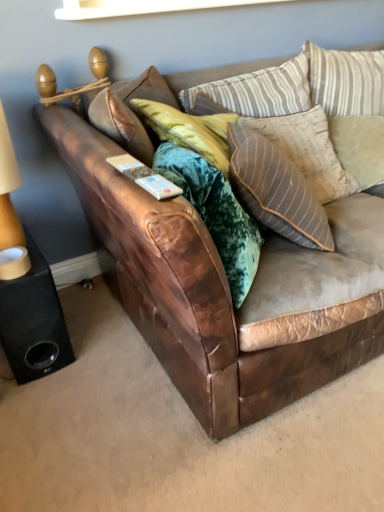
What is the approximate height of striped fabric pillow at upper center, placed as the 1th pillow when sorted from left to right?

The height of striped fabric pillow at upper center, placed as the 1th pillow when sorted from left to right, is 24.21 centimeters.

Find the location of a particular element. This screenshot has height=512, width=384. striped fabric pillow at upper center, the third pillow when ordered from right to left is located at coordinates (259, 91).

I want to click on striped fabric pillow at upper center, the third pillow when ordered from right to left, so click(x=259, y=91).

Is brown leather couch at center shorter than beige fabric lampshade at left?

In fact, brown leather couch at center may be taller than beige fabric lampshade at left.

Considering the positions of objects brown leather couch at center and beige fabric lampshade at left in the image provided, who is behind, brown leather couch at center or beige fabric lampshade at left?

Positioned behind is beige fabric lampshade at left.

Who is bigger, brown leather couch at center or beige fabric lampshade at left?

With larger size is brown leather couch at center.

Would you say brown leather couch at center is outside beige fabric lampshade at left?

brown leather couch at center lies outside beige fabric lampshade at left's area.

Based on the photo, could you tell me if brown leather couch at center is facing black matte speaker at lower left?

No, brown leather couch at center is not facing towards black matte speaker at lower left.

Measure the distance from brown leather couch at center to black matte speaker at lower left.

brown leather couch at center and black matte speaker at lower left are 19.80 inches apart from each other.

Is brown leather couch at center taller than black matte speaker at lower left?

Indeed, brown leather couch at center has a greater height compared to black matte speaker at lower left.

Consider the image. Can you confirm if brown leather couch at center is bigger than black matte speaker at lower left?

Yes.

Considering the relative positions of beige textured pillow at upper right, the third pillow from the left, and brown leather couch at center in the image provided, is beige textured pillow at upper right, the third pillow from the left, to the left or to the right of brown leather couch at center?

beige textured pillow at upper right, the third pillow from the left, is to the right of brown leather couch at center.

From the image's perspective, count 2nd pillows upward from the brown leather couch at center and point to it. Please provide its 2D coordinates.

[(360, 146)]

Does beige textured pillow at upper right, arranged as the 1th pillow when viewed from the right, turn towards brown leather couch at center?

Yes, beige textured pillow at upper right, arranged as the 1th pillow when viewed from the right, faces towards brown leather couch at center.

Is brown leather couch at center spatially inside beige textured pillow at upper right, the third pillow from the left, or outside of it?

brown leather couch at center exists outside the volume of beige textured pillow at upper right, the third pillow from the left.

Between brown leather couch at center and beige textured pillow at upper right, the third pillow from the left, which one is positioned in front?

brown leather couch at center is closer to the camera.

From the image's perspective, is brown leather couch at center above or below beige textured pillow at upper right, the third pillow from the left?

Based on their image positions, brown leather couch at center is located beneath beige textured pillow at upper right, the third pillow from the left.

Can you confirm if brown leather couch at center is smaller than beige textured pillow at upper right, arranged as the 1th pillow when viewed from the right?

Actually, brown leather couch at center might be larger than beige textured pillow at upper right, arranged as the 1th pillow when viewed from the right.

Does beige textured pillow at upper right, the third pillow from the left, turn towards striped fabric pillow at upper right, placed as the 2th pillow when sorted from right to left?

No, beige textured pillow at upper right, the third pillow from the left, does not turn towards striped fabric pillow at upper right, placed as the 2th pillow when sorted from right to left.

Considering the sizes of objects beige textured pillow at upper right, the third pillow from the left, and striped fabric pillow at upper right, placed as the 2th pillow when sorted from right to left, in the image provided, who is bigger, beige textured pillow at upper right, the third pillow from the left, or striped fabric pillow at upper right, placed as the 2th pillow when sorted from right to left,?

striped fabric pillow at upper right, placed as the 2th pillow when sorted from right to left.

Looking at this image, considering the positions of objects beige textured pillow at upper right, arranged as the 1th pillow when viewed from the right, and striped fabric pillow at upper right, placed as the 2th pillow when sorted from right to left, in the image provided, who is more to the left, beige textured pillow at upper right, arranged as the 1th pillow when viewed from the right, or striped fabric pillow at upper right, placed as the 2th pillow when sorted from right to left,?

striped fabric pillow at upper right, placed as the 2th pillow when sorted from right to left.

Considering their positions, is beige textured pillow at upper right, the third pillow from the left, located in front of or behind striped fabric pillow at upper right, placed as the 2th pillow when sorted from right to left?

beige textured pillow at upper right, the third pillow from the left, is behind striped fabric pillow at upper right, placed as the 2th pillow when sorted from right to left.

Between point (0, 172) and point (244, 99), which one is positioned behind?

The point (244, 99) is farther.

Could you tell me if beige fabric lampshade at left is turned towards striped fabric pillow at upper center, placed as the 1th pillow when sorted from left to right?

No, beige fabric lampshade at left is not turned towards striped fabric pillow at upper center, placed as the 1th pillow when sorted from left to right.

Which of these two, beige fabric lampshade at left or striped fabric pillow at upper center, placed as the 1th pillow when sorted from left to right, is wider?

beige fabric lampshade at left.

From the image's perspective, which is below, beige fabric lampshade at left or striped fabric pillow at upper center, placed as the 1th pillow when sorted from left to right?

beige fabric lampshade at left is shown below in the image.

Considering the relative sizes of beige textured pillow at upper right, the third pillow from the left, and striped fabric pillow at upper center, the third pillow when ordered from right to left, in the image provided, is beige textured pillow at upper right, the third pillow from the left, thinner than striped fabric pillow at upper center, the third pillow when ordered from right to left,?

In fact, beige textured pillow at upper right, the third pillow from the left, might be wider than striped fabric pillow at upper center, the third pillow when ordered from right to left.

From the image's perspective, is beige textured pillow at upper right, the third pillow from the left, above striped fabric pillow at upper center, the third pillow when ordered from right to left?

Actually, beige textured pillow at upper right, the third pillow from the left, appears below striped fabric pillow at upper center, the third pillow when ordered from right to left, in the image.

Considering the sizes of beige textured pillow at upper right, arranged as the 1th pillow when viewed from the right, and striped fabric pillow at upper center, placed as the 1th pillow when sorted from left to right, in the image, is beige textured pillow at upper right, arranged as the 1th pillow when viewed from the right, taller or shorter than striped fabric pillow at upper center, placed as the 1th pillow when sorted from left to right,?

Clearly, beige textured pillow at upper right, arranged as the 1th pillow when viewed from the right, is shorter compared to striped fabric pillow at upper center, placed as the 1th pillow when sorted from left to right.

Is beige textured pillow at upper right, arranged as the 1th pillow when viewed from the right, inside or outside of striped fabric pillow at upper center, the third pillow when ordered from right to left?

beige textured pillow at upper right, arranged as the 1th pillow when viewed from the right, is outside striped fabric pillow at upper center, the third pillow when ordered from right to left.

Where is `table lamp that appears behind the brown leather couch at center`? This screenshot has width=384, height=512. table lamp that appears behind the brown leather couch at center is located at coordinates (10, 211).

The image size is (384, 512). I want to click on studio couch on the right side of black matte speaker at lower left, so click(211, 295).

Looking at the image, which one is located closer to striped fabric pillow at upper right, the 2th pillow in the left-to-right sequence, black matte speaker at lower left or beige textured pillow at upper right, the third pillow from the left?

The object closer to striped fabric pillow at upper right, the 2th pillow in the left-to-right sequence, is beige textured pillow at upper right, the third pillow from the left.

Estimate the real-world distances between objects in this image. Which object is further from beige fabric lampshade at left, beige textured pillow at upper right, arranged as the 1th pillow when viewed from the right, or striped fabric pillow at upper right, the 2th pillow in the left-to-right sequence?

The object further to beige fabric lampshade at left is beige textured pillow at upper right, arranged as the 1th pillow when viewed from the right.

When comparing their distances from striped fabric pillow at upper center, the third pillow when ordered from right to left, does black matte speaker at lower left or beige fabric lampshade at left seem further?

Among the two, black matte speaker at lower left is located further to striped fabric pillow at upper center, the third pillow when ordered from right to left.

When comparing their distances from striped fabric pillow at upper right, placed as the 2th pillow when sorted from right to left, does beige textured pillow at upper right, the third pillow from the left, or brown leather couch at center seem closer?

beige textured pillow at upper right, the third pillow from the left, is closer to striped fabric pillow at upper right, placed as the 2th pillow when sorted from right to left.

In the scene shown: Looking at the image, which one is located further to brown leather couch at center, striped fabric pillow at upper center, placed as the 1th pillow when sorted from left to right, or striped fabric pillow at upper right, placed as the 2th pillow when sorted from right to left?

striped fabric pillow at upper center, placed as the 1th pillow when sorted from left to right, lies further to brown leather couch at center than the other object.

Looking at the image, which one is located closer to striped fabric pillow at upper center, the third pillow when ordered from right to left, beige textured pillow at upper right, the third pillow from the left, or brown leather couch at center?

beige textured pillow at upper right, the third pillow from the left, is closer to striped fabric pillow at upper center, the third pillow when ordered from right to left.

Which object lies further to the anchor point brown leather couch at center, striped fabric pillow at upper right, the 2th pillow in the left-to-right sequence, or black matte speaker at lower left?

black matte speaker at lower left is positioned further to the anchor brown leather couch at center.

Considering their positions, is beige fabric lampshade at left positioned further to black matte speaker at lower left than beige textured pillow at upper right, the third pillow from the left?

beige textured pillow at upper right, the third pillow from the left, is positioned further to the anchor black matte speaker at lower left.

Locate an element on the screen. speaker between beige fabric lampshade at left and striped fabric pillow at upper right, the 2th pillow in the left-to-right sequence, from left to right is located at coordinates coord(33,321).

Find the location of a particular element. Image resolution: width=384 pixels, height=512 pixels. pillow between striped fabric pillow at upper center, the third pillow when ordered from right to left, and beige textured pillow at upper right, arranged as the 1th pillow when viewed from the right is located at coordinates (308, 150).

This screenshot has width=384, height=512. In order to click on studio couch located between black matte speaker at lower left and beige textured pillow at upper right, arranged as the 1th pillow when viewed from the right, in the left-right direction in this screenshot , I will do `click(211, 295)`.

Where is `speaker located between beige fabric lampshade at left and striped fabric pillow at upper center, the third pillow when ordered from right to left, in the left-right direction`? This screenshot has height=512, width=384. speaker located between beige fabric lampshade at left and striped fabric pillow at upper center, the third pillow when ordered from right to left, in the left-right direction is located at coordinates (33, 321).